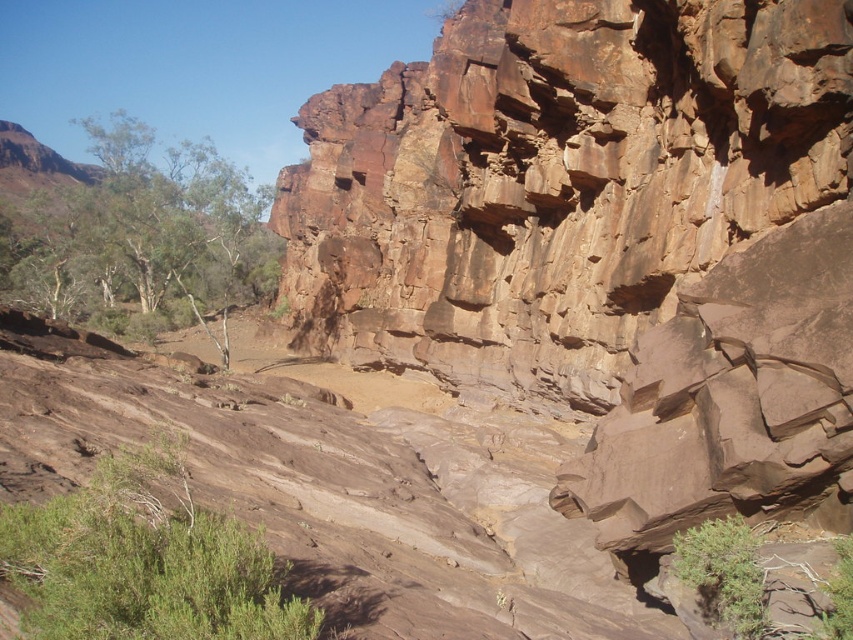
Question: Is brown rough rock face at upper center wider than green leafy shrub at lower left?

Choices:
 (A) yes
 (B) no

Answer: (A)

Question: Can you confirm if brown rough rock face at upper center is positioned to the left of green leafy shrub at lower left?

Choices:
 (A) yes
 (B) no

Answer: (B)

Question: Which object is farther from the camera taking this photo?

Choices:
 (A) green leafy tree at upper left
 (B) brown rough rock face at upper center

Answer: (A)

Question: Which of these objects is positioned closest to the green leafy shrub at lower left?

Choices:
 (A) brown rough rock face at upper center
 (B) green leafy tree at upper left

Answer: (A)

Question: Does brown rough rock face at upper center appear on the left side of green leafy tree at upper left?

Choices:
 (A) no
 (B) yes

Answer: (A)

Question: Which point is farther to the camera?

Choices:
 (A) (260, 605)
 (B) (746, 177)
 (C) (125, 115)

Answer: (C)